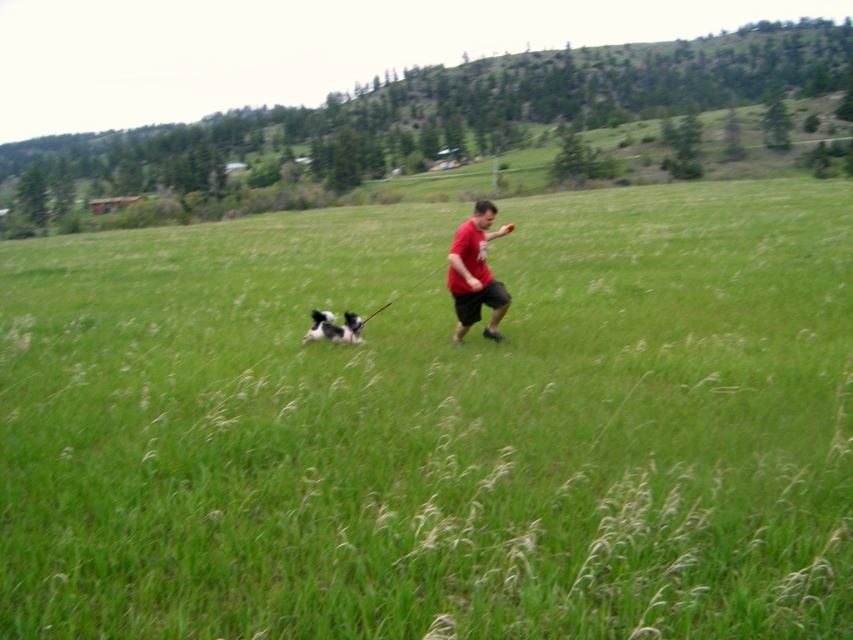
Is red matte shirt at center below black and white fur at center?

Incorrect, red matte shirt at center is not positioned below black and white fur at center.

I want to click on red matte shirt at center, so click(x=474, y=273).

Can you confirm if green grassy field at center is wider than black and white fur at center?

Yes, green grassy field at center is wider than black and white fur at center.

Locate an element on the screen. The image size is (853, 640). green grassy field at center is located at coordinates (436, 424).

Is green grassy field at center positioned before red matte shirt at center?

Yes, green grassy field at center is closer to the viewer.

Who is higher up, green grassy field at center or red matte shirt at center?

green grassy field at center

Is point (207, 289) behind point (492, 218)?

Yes, point (207, 289) is farther from viewer.

Identify the location of green grassy field at center. (436, 424).